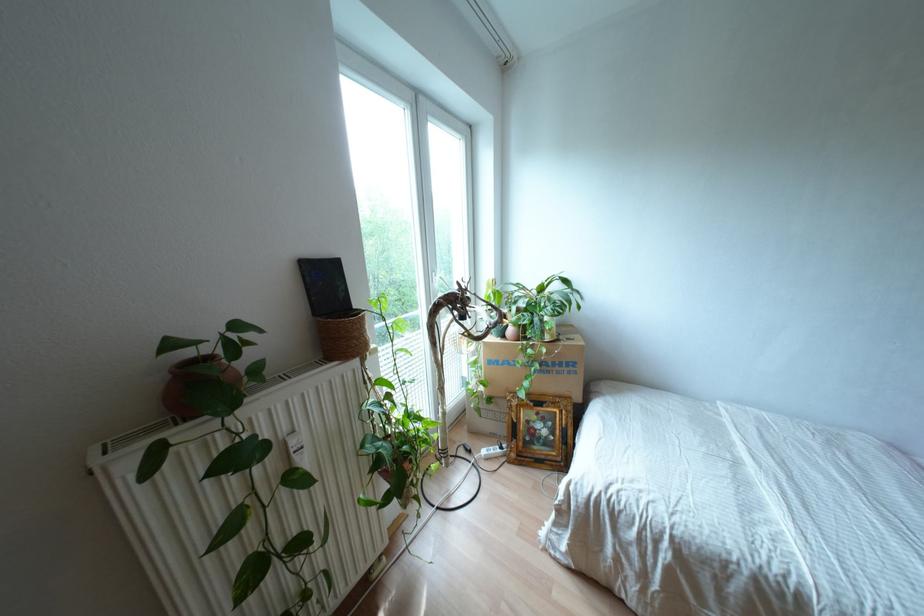
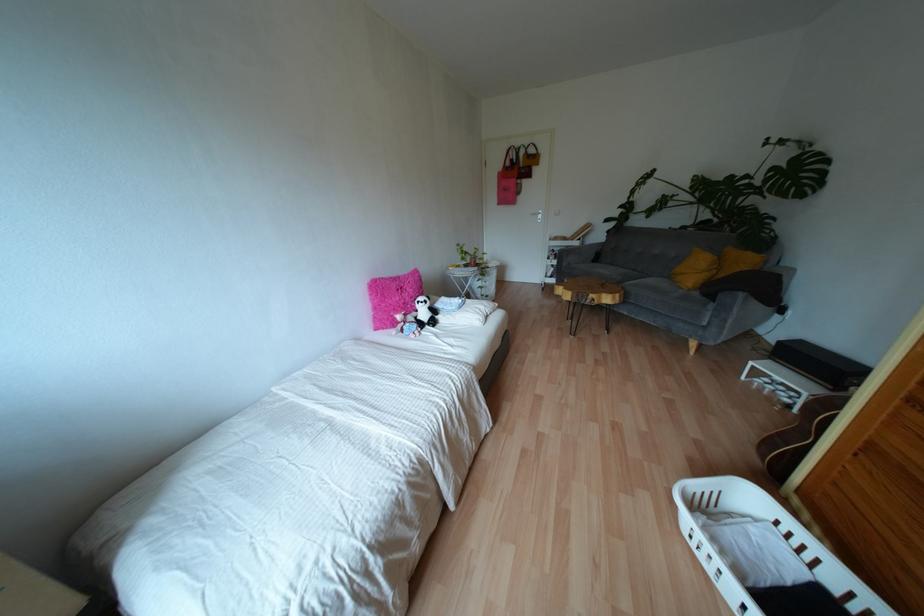
The images are taken continuously from a first-person perspective. In which direction is your viewpoint rotating?

The camera rotated toward right-down.